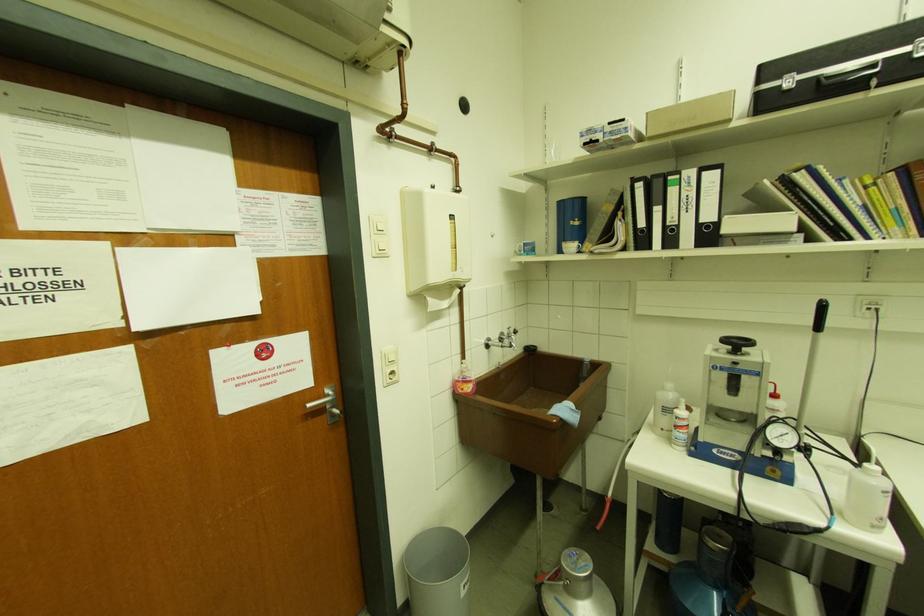
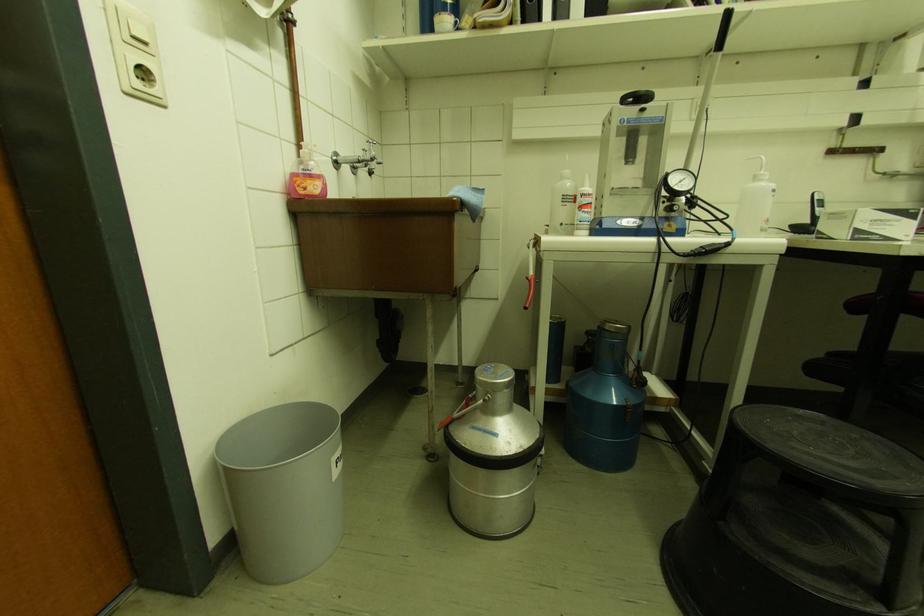
Question: How did the camera likely rotate?

Choices:
 (A) Left
 (B) Right
 (C) Up
 (D) Down

Answer: (B)